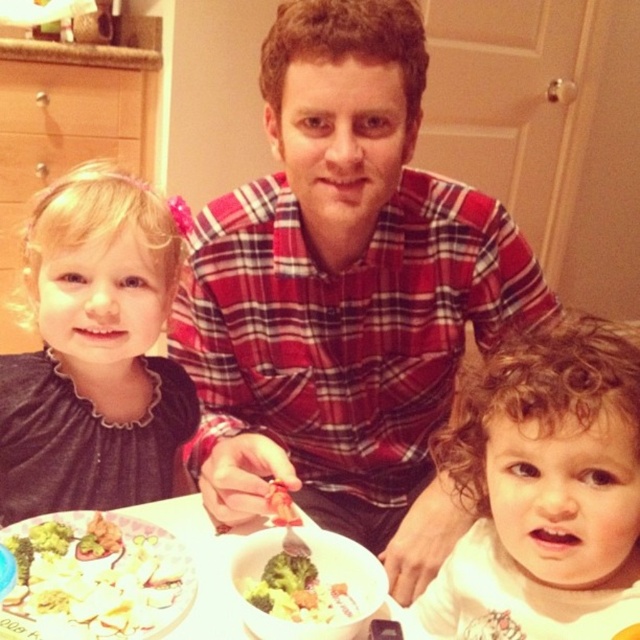
You are a chef preparing a meal and need to place the green broccoli at lower center onto the white glossy bowl at center. Can you do this without moving the bowl?

The white glossy bowl at center is positioned over green broccoli at lower center, so the broccoli is already on the bowl. No need to move the bowl.

You are a photographer trying to capture a group photo of the red plaid shirt at center and the dark gray fabric dress at left. Which subject should you position closer to the left side of the frame to maintain their original arrangement?

The dark gray fabric dress at left should be positioned closer to the left side of the frame since the red plaid shirt at center is on its right side, maintaining their original arrangement.